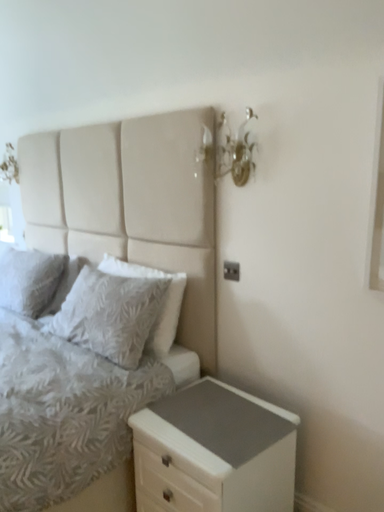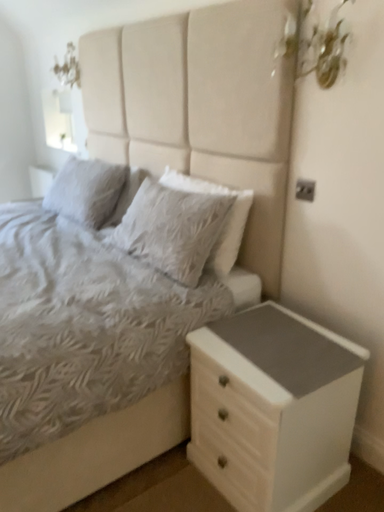
Question: How did the camera likely rotate when shooting the video?

Choices:
 (A) rotated left
 (B) rotated right

Answer: (A)